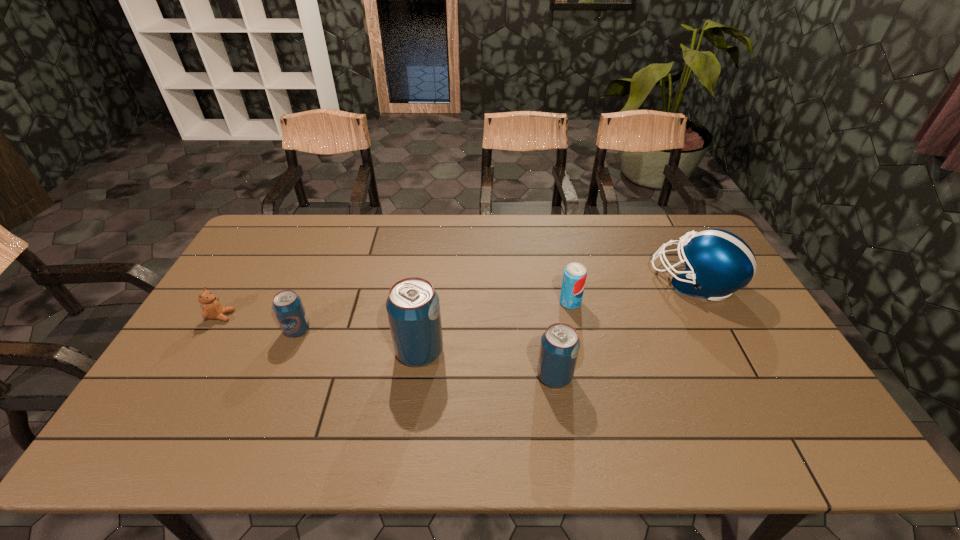
What are the coordinates of `free space that is in between the rightmost object and the third tallest object` in the screenshot? It's located at (624, 329).

The image size is (960, 540). I want to click on free spot between the fourth object from left to right and the third object from left to right, so click(487, 364).

You are a GUI agent. You are given a task and a screenshot of the screen. Output one action in this format:
    pyautogui.click(x=<x>, y=<y>)
    Task: Click on the empty location between the tallest soda can and the leftmost object
    
    Given the screenshot: What is the action you would take?
    pyautogui.click(x=321, y=334)

Find the location of a particular element. The image size is (960, 540). free space between the rightmost soda can and the fourth object from right to left is located at coordinates (494, 327).

Find the location of a particular element. free space between the tallest soda can and the fifth object from left to right is located at coordinates (494, 327).

Select which object is the second closest to the tallest soda can. Please provide its 2D coordinates. Your answer should be formatted as a tuple, i.e. [(x, y)], where the tuple contains the x and y coordinates of a point satisfying the conditions above.

[(287, 305)]

I want to click on object that is the third nearest to the leftmost object, so click(560, 344).

Where is `soda can that is the third closest one to the rightmost soda can`? This screenshot has width=960, height=540. soda can that is the third closest one to the rightmost soda can is located at coordinates (287, 305).

Select which soda can is the second closest to the leftmost soda can. Please provide its 2D coordinates. Your answer should be formatted as a tuple, i.e. [(x, y)], where the tuple contains the x and y coordinates of a point satisfying the conditions above.

[(560, 344)]

The height and width of the screenshot is (540, 960). I want to click on vacant space that satisfies the following two spatial constraints: 1. on the face of the third soda can from right to left; 2. on the left side of the shortest object, so click(200, 352).